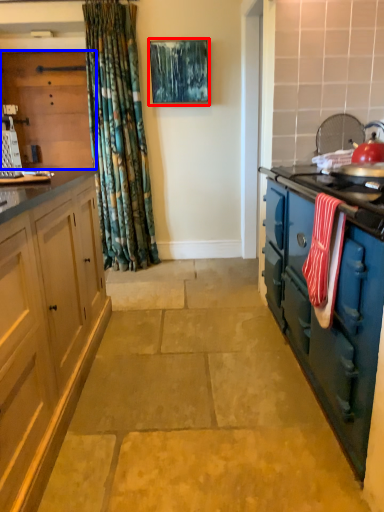
Question: Which of the following is the farthest to the observer, picture frame (highlighted by a red box) or cabinetry (highlighted by a blue box)?

Choices:
 (A) picture frame
 (B) cabinetry

Answer: (B)